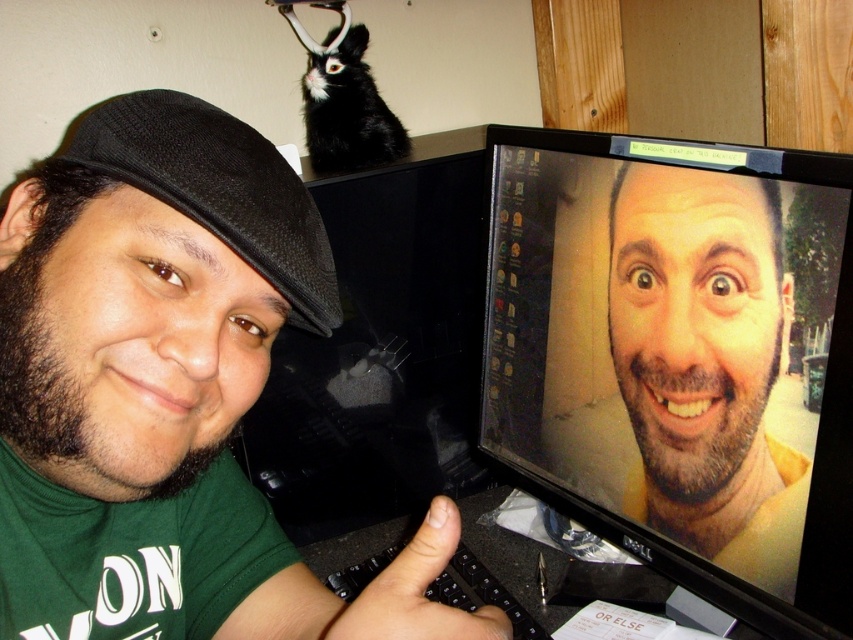
From the picture: Does matte black monitor at center come behind smooth skin face at center?

No, it is not.

Does matte black monitor at center have a lesser width compared to smooth skin face at center?

No, matte black monitor at center is not thinner than smooth skin face at center.

What do you see at coordinates (680, 358) in the screenshot?
I see `matte black monitor at center` at bounding box center [680, 358].

I want to click on matte black monitor at center, so pyautogui.click(x=680, y=358).

Is green matte shirt at center behind smooth skin face at center?

That is False.

Can you confirm if green matte shirt at center is wider than smooth skin face at center?

Yes.

Image resolution: width=853 pixels, height=640 pixels. Identify the location of green matte shirt at center. (149, 294).

Can you confirm if matte black monitor at center is positioned to the left of green matte shirt at center?

No, matte black monitor at center is not to the left of green matte shirt at center.

Can you confirm if matte black monitor at center is smaller than green matte shirt at center?

Incorrect, matte black monitor at center is not smaller in size than green matte shirt at center.

What do you see at coordinates (680, 358) in the screenshot? This screenshot has height=640, width=853. I see `matte black monitor at center` at bounding box center [680, 358].

Identify the location of matte black monitor at center. (680, 358).